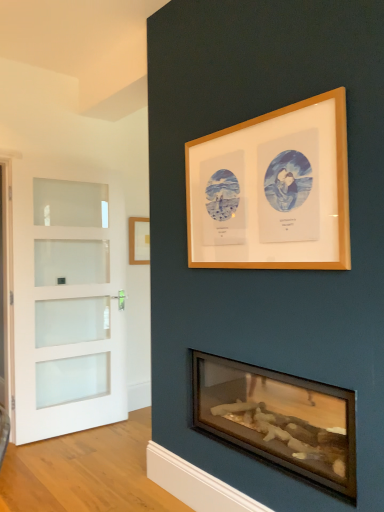
Question: Would you say white frosted glass door at left is to the left or to the right of wooden picture frame at upper center, acting as the 2th picture frame starting from the back, in the picture?

Choices:
 (A) right
 (B) left

Answer: (B)

Question: Considering the positions of white frosted glass door at left and wooden picture frame at upper center, the first picture frame when ordered from right to left, in the image, is white frosted glass door at left wider or thinner than wooden picture frame at upper center, the first picture frame when ordered from right to left,?

Choices:
 (A) thin
 (B) wide

Answer: (B)

Question: Which of these objects is positioned farthest from the white frosted glass door at left?

Choices:
 (A) white frosted glass screen door at left
 (B) wooden picture frame at upper center, marked as the 1th picture frame in a front-to-back arrangement
 (C) wooden logs at lower center
 (D) wooden picture frame at center, the second picture frame in the right-to-left sequence

Answer: (B)

Question: Which is farther from the wooden picture frame at upper center, the first picture frame when ordered from right to left?

Choices:
 (A) wooden picture frame at center, which appears as the 1th picture frame when viewed from the back
 (B) wooden logs at lower center
 (C) white frosted glass screen door at left
 (D) white frosted glass door at left

Answer: (C)